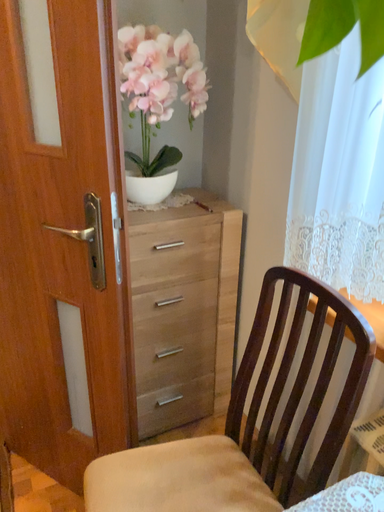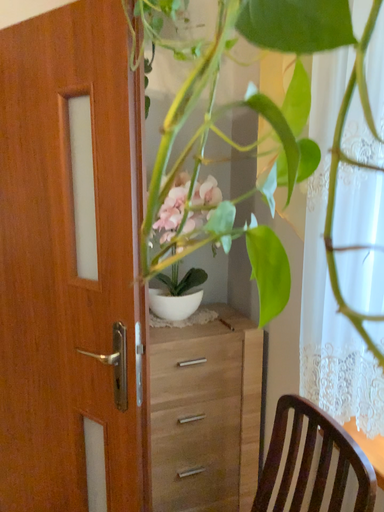
Question: Which way did the camera rotate in the video?

Choices:
 (A) rotated downward
 (B) rotated upward

Answer: (B)